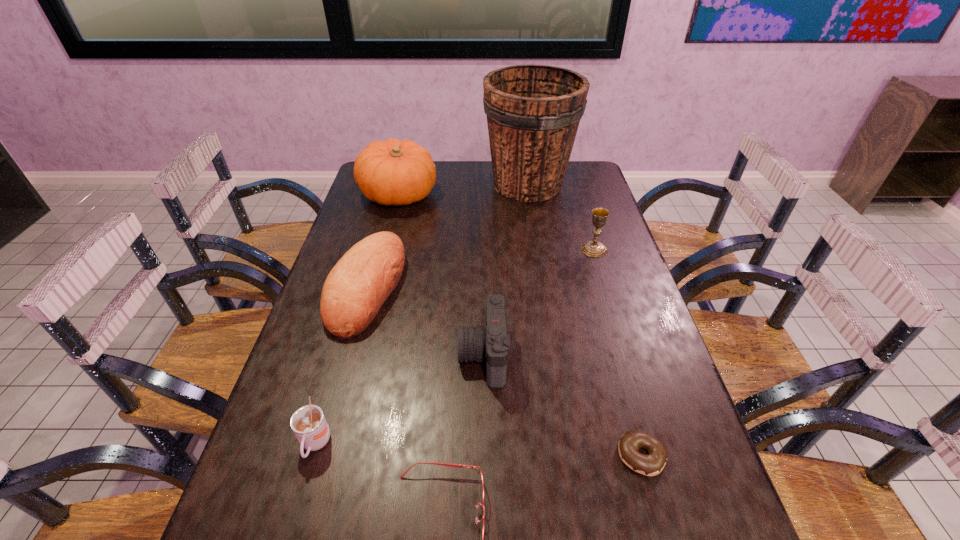
Identify the location of free space located 0.240m at the lens of the camera. (361, 355).

At what (x,y) coordinates should I click in order to perform the action: click on blank area located at the lens of the camera. Please return your answer as a coordinate pair (x, y). Image resolution: width=960 pixels, height=540 pixels. Looking at the image, I should click on click(x=406, y=355).

Locate an element on the screen. blank space located at the lens of the camera is located at coordinates 406,355.

The width and height of the screenshot is (960, 540). In order to click on vacant space situated 0.290m on the back of the bread in this screenshot , I will do 392,197.

Locate an element on the screen. free space located on the side with the handle of the cup is located at coordinates (300, 499).

You are a GUI agent. You are given a task and a screenshot of the screen. Output one action in this format:
    pyautogui.click(x=<x>, y=<y>)
    Task: Click on the blank area located on the back of the doughnut
    The height and width of the screenshot is (540, 960).
    Given the screenshot: What is the action you would take?
    pyautogui.click(x=627, y=404)

You are a GUI agent. You are given a task and a screenshot of the screen. Output one action in this format:
    pyautogui.click(x=<x>, y=<y>)
    Task: Click on the bucket situated at the far edge
    The image size is (960, 540).
    Given the screenshot: What is the action you would take?
    pyautogui.click(x=533, y=112)

Where is `pumpkin that is positioned at the far edge`? pumpkin that is positioned at the far edge is located at coordinates (393, 172).

Find the location of a particular element. This screenshot has height=540, width=960. pumpkin present at the left edge is located at coordinates (393, 172).

Locate an element on the screen. bread located in the left edge section of the desktop is located at coordinates (354, 291).